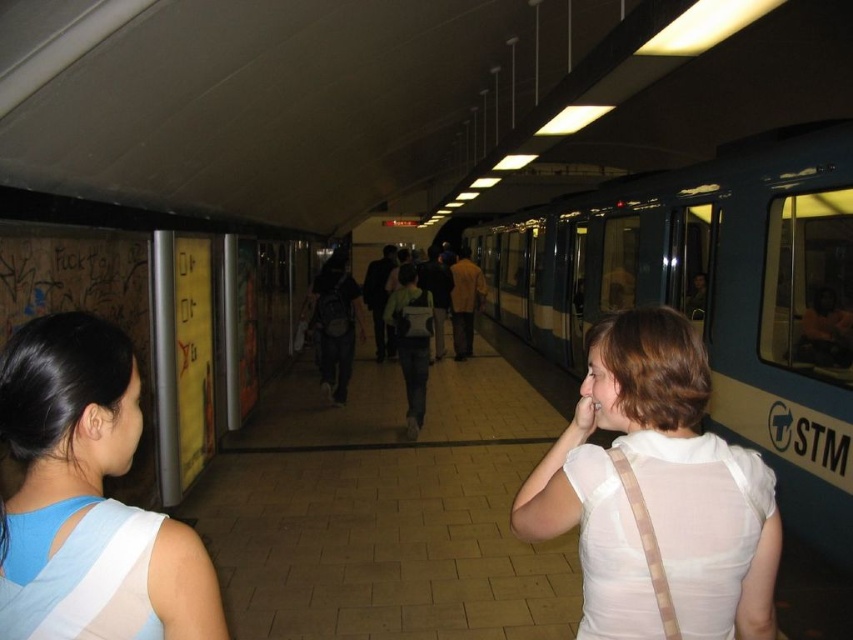
Is point (566, 244) farther from viewer compared to point (105, 348)?

Yes, it is.

Does blue metallic train at center have a larger size compared to blue fabric shirt at left?

Yes.

Locate an element on the screen. Image resolution: width=853 pixels, height=640 pixels. blue metallic train at center is located at coordinates (717, 296).

Between white sheer blouse at center and blue fabric shirt at left, which one has less height?

With less height is blue fabric shirt at left.

Based on the photo, which is above, white sheer blouse at center or blue fabric shirt at left?

blue fabric shirt at left

Is point (693, 355) farther from camera compared to point (67, 404)?

Yes, point (693, 355) is farther from viewer.

Find the location of a particular element. The width and height of the screenshot is (853, 640). white sheer blouse at center is located at coordinates (657, 493).

Can you confirm if blue metallic train at center is positioned to the right of white sheer blouse at center?

Indeed, blue metallic train at center is positioned on the right side of white sheer blouse at center.

Is point (792, 221) behind point (730, 500)?

Yes, it is behind point (730, 500).

Locate an element on the screen. Image resolution: width=853 pixels, height=640 pixels. blue metallic train at center is located at coordinates (717, 296).

Identify the location of blue metallic train at center. The image size is (853, 640). (717, 296).